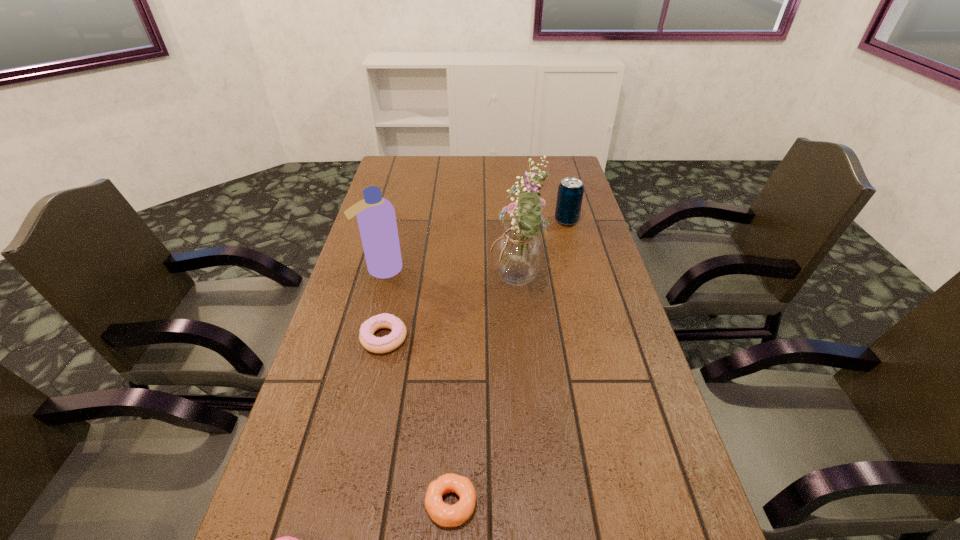
Where is `bouquet`? bouquet is located at coordinates click(x=518, y=252).

Identify the location of the fifth object from left to right. This screenshot has width=960, height=540. (518, 252).

Where is `shampoo`? This screenshot has width=960, height=540. shampoo is located at coordinates (376, 218).

Find the location of a particular element. the fourth shortest object is located at coordinates (570, 191).

I want to click on soda can, so click(x=570, y=191).

You are a GUI agent. You are given a task and a screenshot of the screen. Output one action in this format:
    pyautogui.click(x=<x>, y=<y>)
    Task: Click on the third nearest object
    
    Given the screenshot: What is the action you would take?
    pyautogui.click(x=390, y=342)

Where is `the third object from right to left`? The height and width of the screenshot is (540, 960). the third object from right to left is located at coordinates (443, 514).

This screenshot has height=540, width=960. What are the coordinates of `the rightmost doughnut` in the screenshot? It's located at 443,514.

You are a GUI agent. You are given a task and a screenshot of the screen. Output one action in this format:
    pyautogui.click(x=<x>, y=<y>)
    Task: Click on the free region located on the front-facing side of the tallest object
    
    Given the screenshot: What is the action you would take?
    pyautogui.click(x=435, y=285)

Locate an element on the screen. This screenshot has width=960, height=540. vacant space located on the front-facing side of the tallest object is located at coordinates (396, 285).